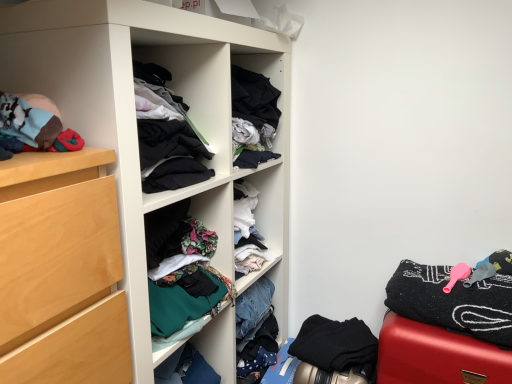
Locate an element on the screen. vacant region above black matte fabric at lower right, which is the first clothing in bottom-to-top order (from a real-world perspective) is located at coordinates (345, 353).